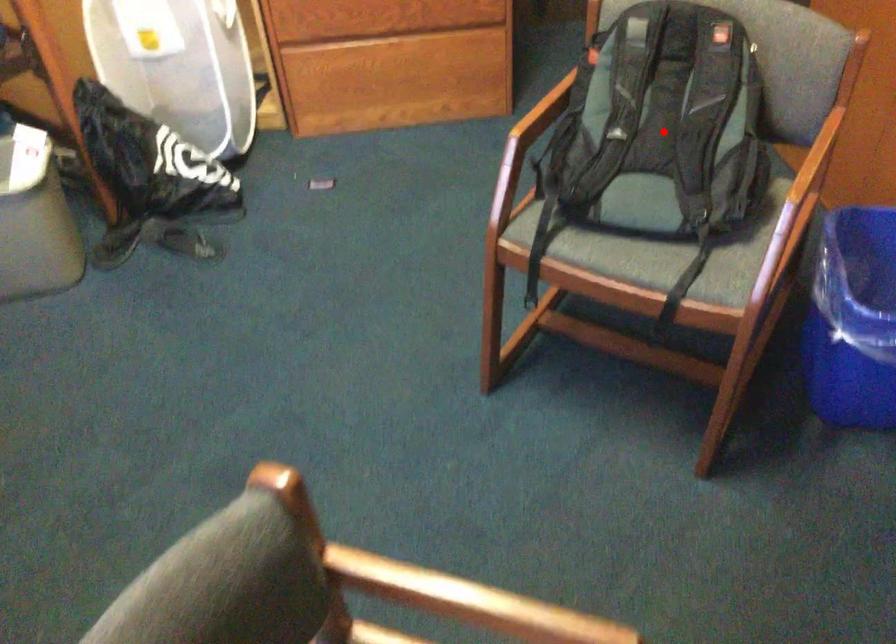
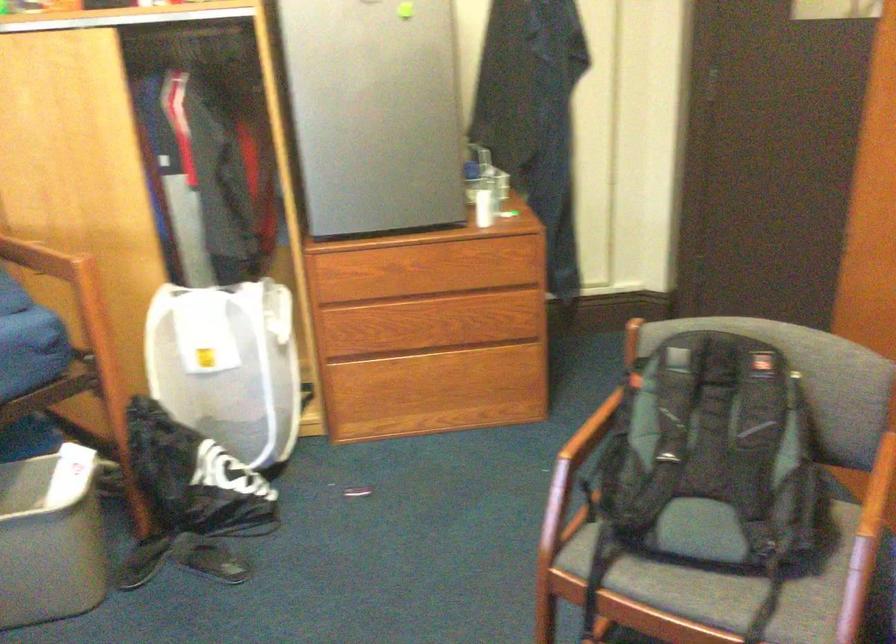
Find the pixel in the second image that matches the highlighted location in the first image.

(717, 456)